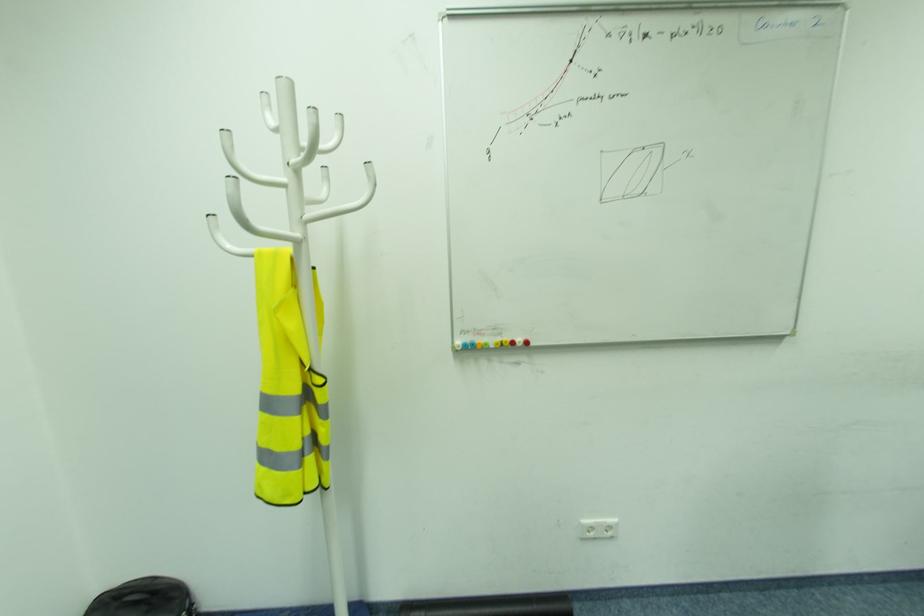
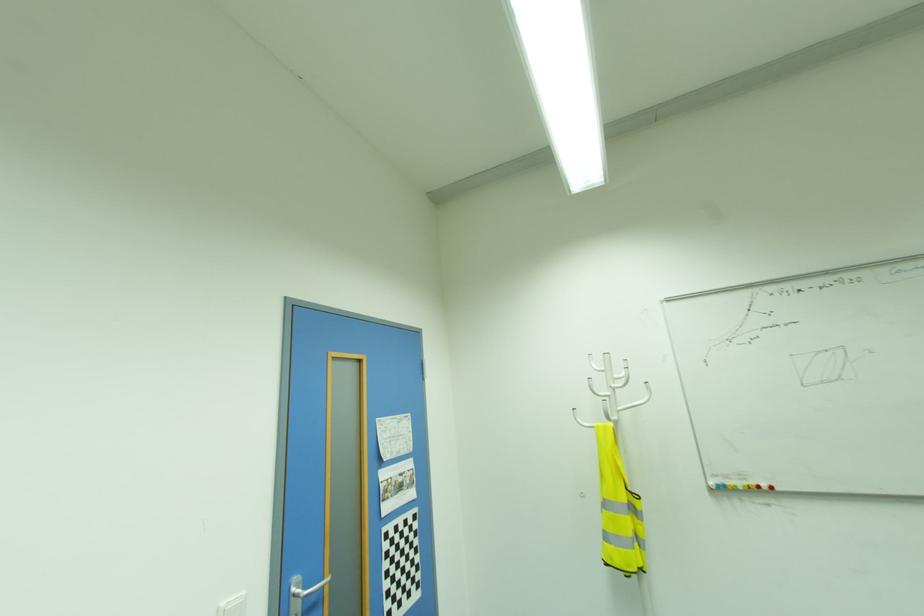
In the second image, find the point that corresponds to (x=309, y=217) in the first image.

(622, 408)